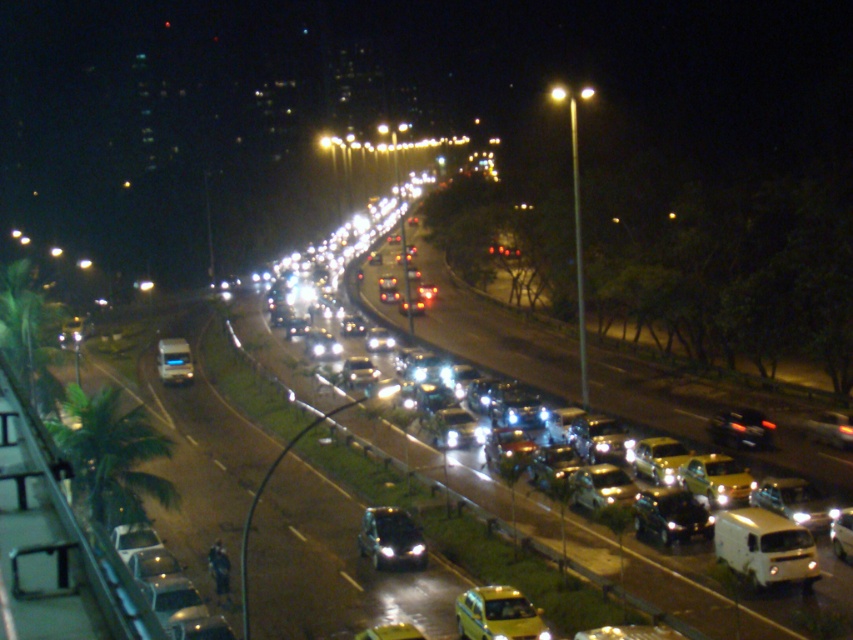
How much distance is there between yellow matte taxi at center and metallic silver car at center?

yellow matte taxi at center and metallic silver car at center are 51.91 meters apart from each other.

Does point (474, 602) come in front of point (171, 355)?

Yes, it is in front of point (171, 355).

The height and width of the screenshot is (640, 853). Identify the location of yellow matte taxi at center. (497, 614).

What are the coordinates of `yellow matte taxi at center` in the screenshot? It's located at (497, 614).

Is white matte van at lower right shorter than shiny black suv at center?

Incorrect, white matte van at lower right's height does not fall short of shiny black suv at center's.

Measure the distance between white matte van at lower right and camera.

white matte van at lower right is 27.72 meters away from camera.

Image resolution: width=853 pixels, height=640 pixels. I want to click on white matte van at lower right, so click(x=764, y=547).

Is white matte van at lower right to the right of yellow matte taxi at center from the viewer's perspective?

Indeed, white matte van at lower right is positioned on the right side of yellow matte taxi at center.

Between point (732, 564) and point (506, 628), which one is positioned in front?

Positioned in front is point (506, 628).

Which is behind, point (801, 536) or point (532, 634)?

The point (801, 536) is more distant.

Find the location of a particular element. white matte van at lower right is located at coordinates (764, 547).